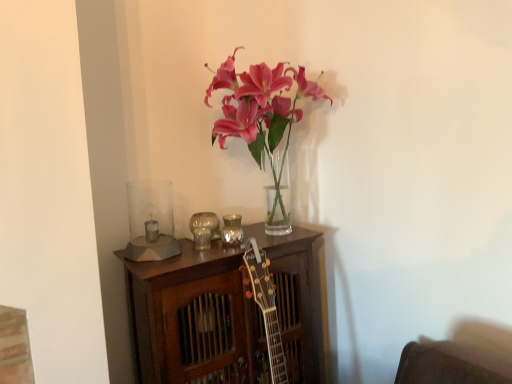
Where is `metallic reflective candle holder at center, acting as the first candle holder starting from the right`? The width and height of the screenshot is (512, 384). metallic reflective candle holder at center, acting as the first candle holder starting from the right is located at coordinates pos(232,230).

This screenshot has width=512, height=384. Find the location of `clear glass candle holder at left, positioned as the 1th candle holder in left-to-right order`. clear glass candle holder at left, positioned as the 1th candle holder in left-to-right order is located at coordinates (151, 221).

Where is `metallic silver candle holder at center, acting as the second candle holder starting from the right`? metallic silver candle holder at center, acting as the second candle holder starting from the right is located at coordinates (204, 229).

The width and height of the screenshot is (512, 384). Identify the location of metallic reflective candle holder at center, acting as the first candle holder starting from the right. (232, 230).

Is metallic silver candle holder at center, acting as the second candle holder starting from the right, turned away from clear glass candle holder at left, positioned as the 1th candle holder in left-to-right order?

No.

Based on the photo, can you confirm if metallic silver candle holder at center, acting as the second candle holder starting from the right, is shorter than clear glass candle holder at left, positioned as the 1th candle holder in left-to-right order?

Yes, metallic silver candle holder at center, acting as the second candle holder starting from the right, is shorter than clear glass candle holder at left, positioned as the 1th candle holder in left-to-right order.

From the image's perspective, is metallic silver candle holder at center, the 2th candle holder viewed from the left, over clear glass candle holder at left, acting as the third candle holder starting from the right?

Yes.

Does metallic silver candle holder at center, the 2th candle holder viewed from the left, have a larger size compared to clear glass candle holder at left, acting as the third candle holder starting from the right?

No, metallic silver candle holder at center, the 2th candle holder viewed from the left, is not bigger than clear glass candle holder at left, acting as the third candle holder starting from the right.

What's the angular difference between metallic silver candle holder at center, acting as the second candle holder starting from the right, and metallic reflective candle holder at center, acting as the first candle holder starting from the right,'s facing directions?

metallic silver candle holder at center, acting as the second candle holder starting from the right, and metallic reflective candle holder at center, acting as the first candle holder starting from the right, are facing 0.00165 degrees away from each other.

Measure the distance from metallic silver candle holder at center, the 2th candle holder viewed from the left, to metallic reflective candle holder at center, which ranks as the 3th candle holder in left-to-right order.

The distance of metallic silver candle holder at center, the 2th candle holder viewed from the left, from metallic reflective candle holder at center, which ranks as the 3th candle holder in left-to-right order, is 2.71 inches.

Can you confirm if metallic silver candle holder at center, acting as the second candle holder starting from the right, is smaller than metallic reflective candle holder at center, which ranks as the 3th candle holder in left-to-right order?

Actually, metallic silver candle holder at center, acting as the second candle holder starting from the right, might be larger than metallic reflective candle holder at center, which ranks as the 3th candle holder in left-to-right order.

Considering the sizes of objects metallic silver candle holder at center, acting as the second candle holder starting from the right, and metallic reflective candle holder at center, acting as the first candle holder starting from the right, in the image provided, who is taller, metallic silver candle holder at center, acting as the second candle holder starting from the right, or metallic reflective candle holder at center, acting as the first candle holder starting from the right,?

With more height is metallic silver candle holder at center, acting as the second candle holder starting from the right.

Which object is wider, metallic reflective candle holder at center, acting as the first candle holder starting from the right, or metallic silver candle holder at center, acting as the second candle holder starting from the right?

Wider between the two is metallic silver candle holder at center, acting as the second candle holder starting from the right.

From the image's perspective, which one is positioned higher, metallic reflective candle holder at center, which ranks as the 3th candle holder in left-to-right order, or metallic silver candle holder at center, the 2th candle holder viewed from the left?

metallic reflective candle holder at center, which ranks as the 3th candle holder in left-to-right order, appears higher in the image.

Would you consider metallic reflective candle holder at center, acting as the first candle holder starting from the right, to be distant from metallic silver candle holder at center, the 2th candle holder viewed from the left?

No, metallic reflective candle holder at center, acting as the first candle holder starting from the right, is in close proximity to metallic silver candle holder at center, the 2th candle holder viewed from the left.

Which is behind, point (237, 240) or point (207, 219)?

The point (207, 219) is farther.

Could you tell me if clear glass candle holder at left, acting as the third candle holder starting from the right, is facing metallic reflective candle holder at center, acting as the first candle holder starting from the right?

No.

Between clear glass candle holder at left, acting as the third candle holder starting from the right, and metallic reflective candle holder at center, which ranks as the 3th candle holder in left-to-right order, which one has larger size?

clear glass candle holder at left, acting as the third candle holder starting from the right, is bigger.

You are a GUI agent. You are given a task and a screenshot of the screen. Output one action in this format:
    pyautogui.click(x=<x>, y=<y>)
    Task: Click on the 2nd candle holder behind the clear glass candle holder at left, positioned as the 1th candle holder in left-to-right order
    The image size is (512, 384).
    Given the screenshot: What is the action you would take?
    click(x=232, y=230)

Is clear glass candle holder at left, acting as the third candle holder starting from the right, wider or thinner than metallic reflective candle holder at center, which ranks as the 3th candle holder in left-to-right order?

clear glass candle holder at left, acting as the third candle holder starting from the right, is wider than metallic reflective candle holder at center, which ranks as the 3th candle holder in left-to-right order.

Would you consider metallic reflective candle holder at center, which ranks as the 3th candle holder in left-to-right order, to be distant from clear glass candle holder at left, acting as the third candle holder starting from the right?

No, metallic reflective candle holder at center, which ranks as the 3th candle holder in left-to-right order, is not far away from clear glass candle holder at left, acting as the third candle holder starting from the right.

From a real-world perspective, between metallic reflective candle holder at center, which ranks as the 3th candle holder in left-to-right order, and clear glass candle holder at left, positioned as the 1th candle holder in left-to-right order, who is vertically lower?

metallic reflective candle holder at center, which ranks as the 3th candle holder in left-to-right order, from a real-world perspective.

What's the angular difference between metallic reflective candle holder at center, acting as the first candle holder starting from the right, and clear glass candle holder at left, positioned as the 1th candle holder in left-to-right order,'s facing directions?

There is a 0.00126-degree angle between the facing directions of metallic reflective candle holder at center, acting as the first candle holder starting from the right, and clear glass candle holder at left, positioned as the 1th candle holder in left-to-right order.

Considering the relative sizes of clear glass candle holder at left, acting as the third candle holder starting from the right, and metallic silver candle holder at center, the 2th candle holder viewed from the left, in the image provided, is clear glass candle holder at left, acting as the third candle holder starting from the right, bigger than metallic silver candle holder at center, the 2th candle holder viewed from the left,?

Indeed, clear glass candle holder at left, acting as the third candle holder starting from the right, has a larger size compared to metallic silver candle holder at center, the 2th candle holder viewed from the left.

Considering the sizes of objects clear glass candle holder at left, acting as the third candle holder starting from the right, and metallic silver candle holder at center, acting as the second candle holder starting from the right, in the image provided, who is shorter, clear glass candle holder at left, acting as the third candle holder starting from the right, or metallic silver candle holder at center, acting as the second candle holder starting from the right,?

Standing shorter between the two is metallic silver candle holder at center, acting as the second candle holder starting from the right.

Considering their positions, is clear glass candle holder at left, positioned as the 1th candle holder in left-to-right order, located in front of or behind metallic silver candle holder at center, acting as the second candle holder starting from the right?

Clearly, clear glass candle holder at left, positioned as the 1th candle holder in left-to-right order, is in front of metallic silver candle holder at center, acting as the second candle holder starting from the right.

Does point (146, 232) lie in front of point (194, 217)?

Yes, it is in front of point (194, 217).

Locate an element on the screen. The width and height of the screenshot is (512, 384). candle holder that is the 2nd one below the clear glass candle holder at left, positioned as the 1th candle holder in left-to-right order (from a real-world perspective) is located at coordinates tap(204, 229).

Starting from the metallic reflective candle holder at center, which ranks as the 3th candle holder in left-to-right order, which candle holder is the 1st one in front? Please provide its 2D coordinates.

[(204, 229)]

Estimate the real-world distances between objects in this image. Which object is closer to metallic silver candle holder at center, the 2th candle holder viewed from the left, metallic reflective candle holder at center, which ranks as the 3th candle holder in left-to-right order, or clear glass candle holder at left, positioned as the 1th candle holder in left-to-right order?

metallic reflective candle holder at center, which ranks as the 3th candle holder in left-to-right order, is closer to metallic silver candle holder at center, the 2th candle holder viewed from the left.

Based on their spatial positions, is clear glass candle holder at left, acting as the third candle holder starting from the right, or metallic reflective candle holder at center, which ranks as the 3th candle holder in left-to-right order, closer to metallic silver candle holder at center, the 2th candle holder viewed from the left?

Based on the image, metallic reflective candle holder at center, which ranks as the 3th candle holder in left-to-right order, appears to be nearer to metallic silver candle holder at center, the 2th candle holder viewed from the left.

From the image, which object appears to be nearer to metallic reflective candle holder at center, acting as the first candle holder starting from the right, metallic silver candle holder at center, acting as the second candle holder starting from the right, or clear glass candle holder at left, acting as the third candle holder starting from the right?

The object closer to metallic reflective candle holder at center, acting as the first candle holder starting from the right, is metallic silver candle holder at center, acting as the second candle holder starting from the right.

When comparing their distances from clear glass candle holder at left, acting as the third candle holder starting from the right, does metallic silver candle holder at center, acting as the second candle holder starting from the right, or metallic reflective candle holder at center, which ranks as the 3th candle holder in left-to-right order, seem closer?

Based on the image, metallic silver candle holder at center, acting as the second candle holder starting from the right, appears to be nearer to clear glass candle holder at left, acting as the third candle holder starting from the right.

When comparing their distances from metallic reflective candle holder at center, acting as the first candle holder starting from the right, does clear glass candle holder at left, positioned as the 1th candle holder in left-to-right order, or metallic silver candle holder at center, acting as the second candle holder starting from the right, seem further?

clear glass candle holder at left, positioned as the 1th candle holder in left-to-right order, lies further to metallic reflective candle holder at center, acting as the first candle holder starting from the right, than the other object.

When comparing their distances from clear glass candle holder at left, positioned as the 1th candle holder in left-to-right order, does metallic reflective candle holder at center, acting as the first candle holder starting from the right, or metallic silver candle holder at center, the 2th candle holder viewed from the left, seem closer?

The object closer to clear glass candle holder at left, positioned as the 1th candle holder in left-to-right order, is metallic silver candle holder at center, the 2th candle holder viewed from the left.

Locate an element on the screen. The width and height of the screenshot is (512, 384). candle holder between clear glass candle holder at left, acting as the third candle holder starting from the right, and metallic reflective candle holder at center, which ranks as the 3th candle holder in left-to-right order, from front to back is located at coordinates (204, 229).